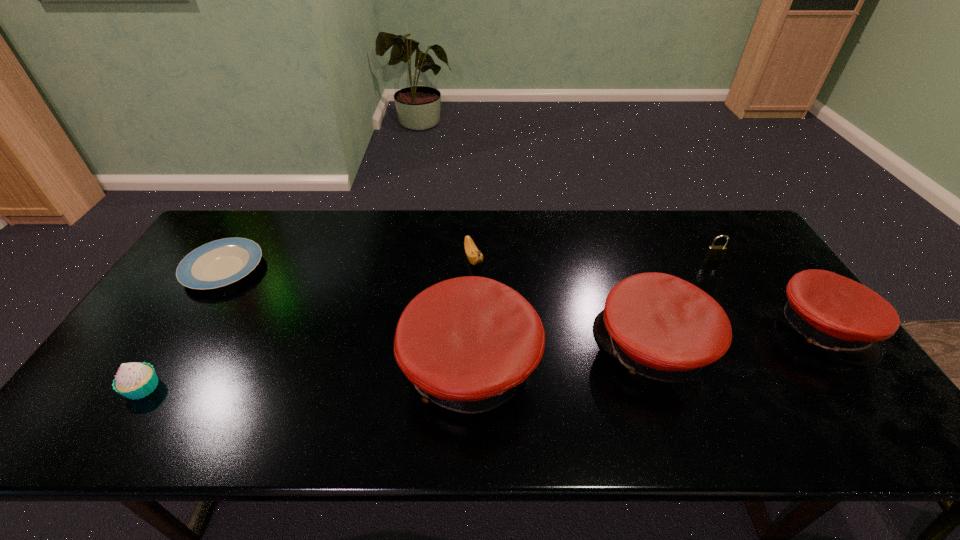
The image size is (960, 540). In order to click on vacant space located 0.230m at the front of the leftmost cap where the visor is located in this screenshot , I will do `click(309, 368)`.

The image size is (960, 540). I want to click on vacant space situated at the front of the leftmost cap where the visor is located, so pos(313,368).

I want to click on vacant region located at the front of the second tallest cap where the visor is located, so click(531, 348).

In order to click on free spot located 0.200m at the front of the second tallest cap where the visor is located in this screenshot , I will do `click(519, 348)`.

At what (x,y) coordinates should I click in order to perform the action: click on vacant space located 0.310m at the front of the second tallest cap where the visor is located. Please return your answer as a coordinate pair (x, y). This screenshot has width=960, height=540. Looking at the image, I should click on (477, 348).

The image size is (960, 540). In order to click on free space located 0.140m on the right of the shortest object in this screenshot , I will do `click(308, 269)`.

Find the location of a particular element. The width and height of the screenshot is (960, 540). vacant region located 0.210m on the back of the banana is located at coordinates (474, 210).

Locate an element on the screen. The width and height of the screenshot is (960, 540). vacant point located on the front-facing side of the padlock is located at coordinates (746, 314).

Identify the location of free location located on the back of the cupcake. (218, 272).

The width and height of the screenshot is (960, 540). What are the coordinates of `plate present at the far edge` in the screenshot? It's located at (221, 262).